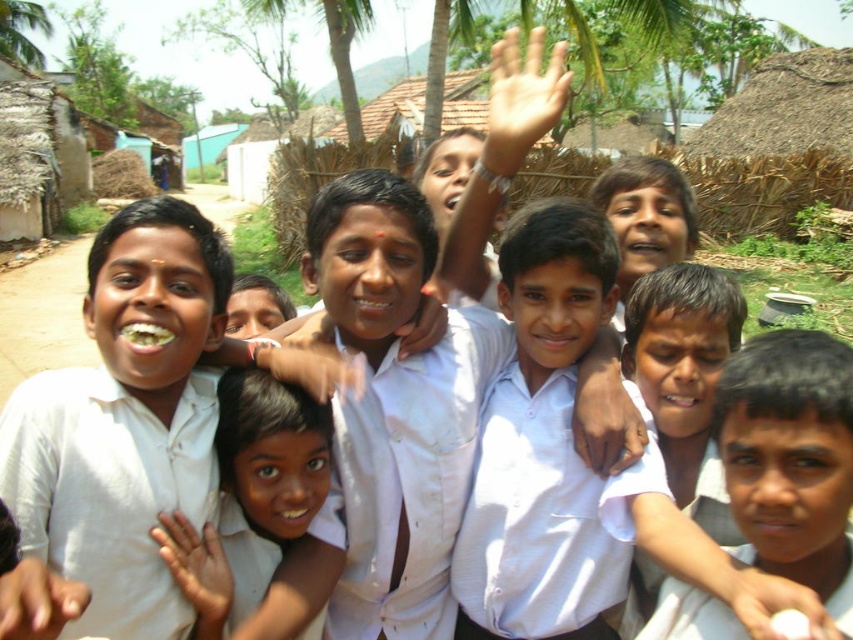
Question: Where is white matte shirt at center located in relation to white glossy shirt at center in the image?

Choices:
 (A) right
 (B) left

Answer: (B)

Question: Can you confirm if white glossy shirt at center is wider than smooth skin face at center?

Choices:
 (A) no
 (B) yes

Answer: (B)

Question: Considering the real-world distances, which object is closest to the white glossy shirt at center?

Choices:
 (A) white matte shirt at center
 (B) white shirt at center
 (C) smooth skin face at center

Answer: (C)

Question: Which object appears farthest from the camera in this image?

Choices:
 (A) light skin hand at upper center
 (B) smooth skin face at center
 (C) white shirt at center

Answer: (A)

Question: Among these objects, which one is farthest from the camera?

Choices:
 (A) white glossy shirt at center
 (B) smooth skin face at center
 (C) white matte shirt at center
 (D) white shirt at center

Answer: (A)

Question: Does white glossy shirt at center come in front of smooth skin face at center?

Choices:
 (A) no
 (B) yes

Answer: (A)